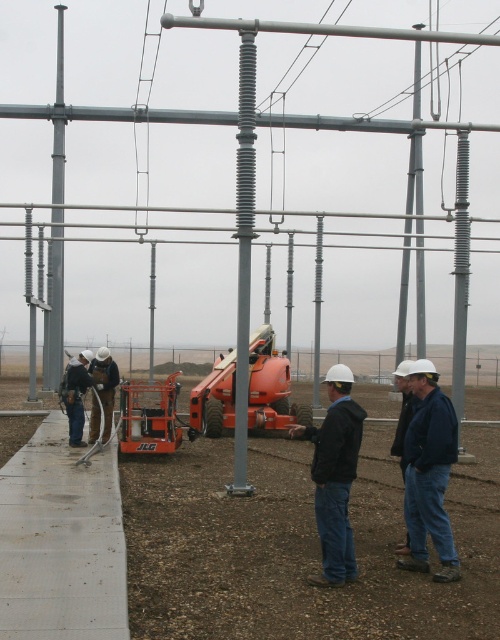
Is white hard hats at center wider than gray metallic pole at left?

Indeed, white hard hats at center has a greater width compared to gray metallic pole at left.

Between white hard hats at center and gray metallic pole at left, which one is positioned higher?

gray metallic pole at left is above.

Locate an element on the screen. white hard hats at center is located at coordinates (299, 547).

Is point (488, 536) positioned behind point (459, 387)?

No, it is in front of (459, 387).

Who is taller, white hard hats at center or gray rubberized insulator at right?

Standing taller between the two is gray rubberized insulator at right.

This screenshot has width=500, height=640. Find the location of `white hard hats at center`. white hard hats at center is located at coordinates (299, 547).

Between gray metallic pole at left and gray metallic pole at center, which one has less height?

gray metallic pole at center

Which is below, gray metallic pole at left or gray metallic pole at center?

gray metallic pole at center is below.

Is point (53, 321) closer to viewer compared to point (149, 358)?

Yes, point (53, 321) is closer to viewer.

You are a GUI agent. You are given a task and a screenshot of the screen. Output one action in this format:
    pyautogui.click(x=<x>, y=<y>)
    Task: Click on the gray metallic pole at left
    The width and height of the screenshot is (500, 640).
    Given the screenshot: What is the action you would take?
    pyautogui.click(x=56, y=300)